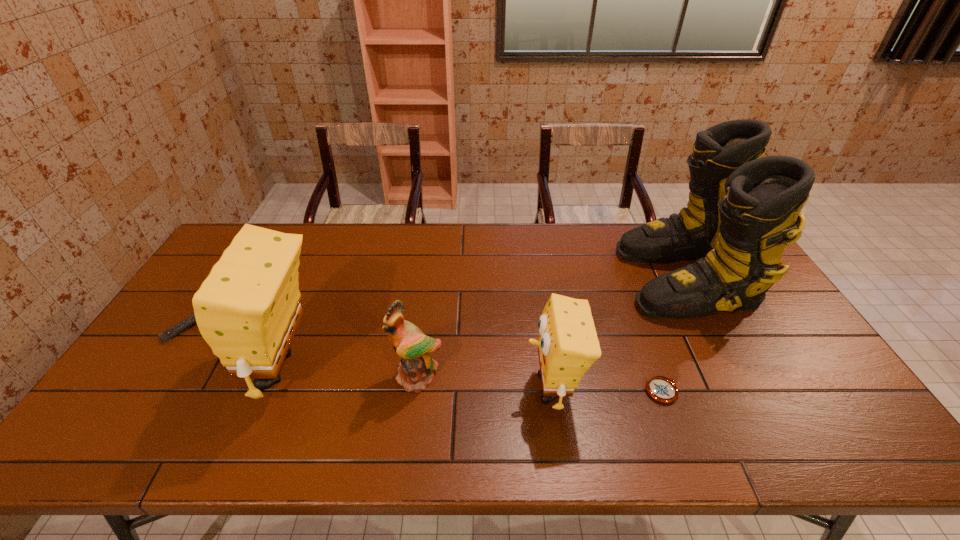
The image size is (960, 540). What are the coordinates of `free spot between the right sponge and the tallest object` in the screenshot? It's located at (618, 333).

Identify the location of empty space that is in between the third object from right to left and the compass. Image resolution: width=960 pixels, height=540 pixels. (607, 389).

This screenshot has height=540, width=960. Find the location of `empty space between the tallest object and the second object from left to right`. empty space between the tallest object and the second object from left to right is located at coordinates (484, 323).

Where is `free space that is in between the ski boots and the remote control`? This screenshot has height=540, width=960. free space that is in between the ski boots and the remote control is located at coordinates (436, 303).

At what (x,y) coordinates should I click in order to perform the action: click on free space between the shorter sponge and the parrot. Please return your answer as a coordinate pair (x, y). This screenshot has height=540, width=960. Looking at the image, I should click on (484, 383).

Locate an element on the screen. free spot between the ski boots and the shorter sponge is located at coordinates (618, 333).

Locate an element on the screen. free space between the second object from left to right and the parrot is located at coordinates (349, 373).

At what (x,y) coordinates should I click in order to perform the action: click on object that stands as the third closest to the fifth object from right to left. Please return your answer as a coordinate pair (x, y). Looking at the image, I should click on (568, 345).

Select which object is the fifth closest to the fourth object from right to left. Please provide its 2D coordinates. Your answer should be formatted as a tuple, i.e. [(x, y)], where the tuple contains the x and y coordinates of a point satisfying the conditions above.

[(743, 208)]

Locate an element on the screen. Image resolution: width=960 pixels, height=540 pixels. vacant space that satisfies the following two spatial constraints: 1. on the face of the right sponge; 2. on the left side of the compass is located at coordinates (553, 391).